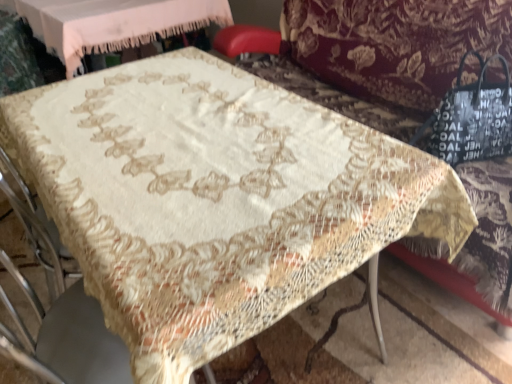
The image size is (512, 384). Describe the element at coordinates (378, 56) in the screenshot. I see `silky beige tablecloth at center` at that location.

This screenshot has width=512, height=384. I want to click on silky beige tablecloth at center, so click(378, 56).

In order to face silky beige tablecloth at center, should I rotate leftwards or rightwards?

To face it directly, rotate right by 16.781 degrees.

This screenshot has height=384, width=512. In order to click on silky beige tablecloth at center in this screenshot , I will do `click(378, 56)`.